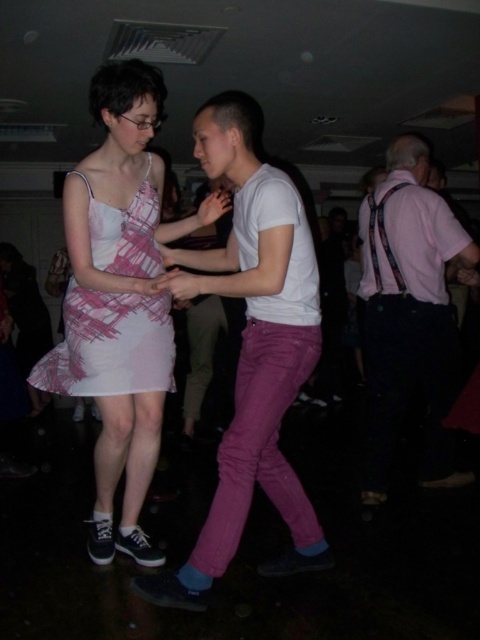
Is pink fabric dress at center positioned in front of pink fabric shirt at right?

Yes, it is.

Who is positioned more to the right, pink fabric dress at center or pink fabric shirt at right?

From the viewer's perspective, pink fabric shirt at right appears more on the right side.

Between point (106, 145) and point (421, 474), which one is positioned in front?

Point (106, 145)

At what (x,y) coordinates should I click in order to perform the action: click on pink fabric dress at center. Please return your answer as a coordinate pair (x, y). This screenshot has height=640, width=480. Looking at the image, I should click on (120, 300).

What do you see at coordinates (120, 300) in the screenshot?
I see `pink fabric dress at center` at bounding box center [120, 300].

From the picture: Measure the distance between pink fabric dress at center and camera.

pink fabric dress at center and camera are 6.12 feet apart from each other.

I want to click on pink fabric dress at center, so click(120, 300).

In the scene shown: Is pink fabric shirt at right below pink printed fabric dress at center?

Indeed, pink fabric shirt at right is positioned under pink printed fabric dress at center.

Which is more to the left, pink fabric shirt at right or pink printed fabric dress at center?

pink printed fabric dress at center

Locate an element on the screen. The height and width of the screenshot is (640, 480). pink fabric shirt at right is located at coordinates (408, 316).

Locate an element on the screen. The width and height of the screenshot is (480, 640). pink fabric shirt at right is located at coordinates (408, 316).